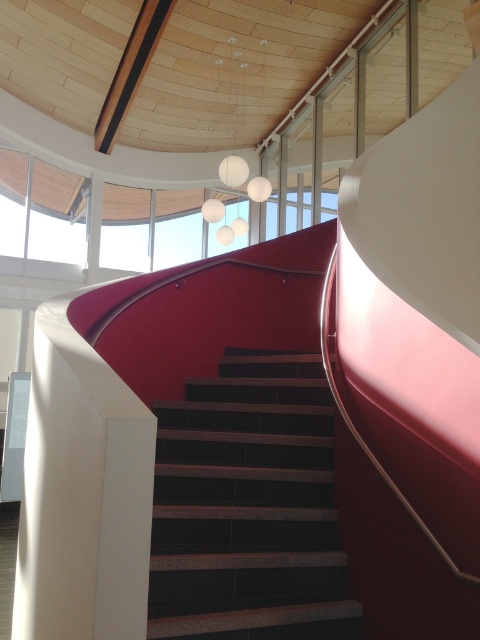
You are standing in the modern interior space and want to look out the clear glass window at upper left. Which direction should you face to see the dark brown textured stairs at center first before looking at the window?

Since the dark brown textured stairs at center is closer to the viewer than the clear glass window at upper left, you should face towards the center of the room where the stairs are located. Once facing the stairs, you can then turn your head or shift your gaze upward and to the left to look at the clear glass window at upper left while keeping the stairs in view.

You are standing at the base of the curved staircase in the image and notice two points marked in the scene. The first point is at coordinates point (x=214, y=552), and the second is at point (x=44, y=241). Which of these points is closer to you as you face the staircase?

Point (x=214, y=552) is in front of point (x=44, y=241), so it is closer to you as you face the staircase.